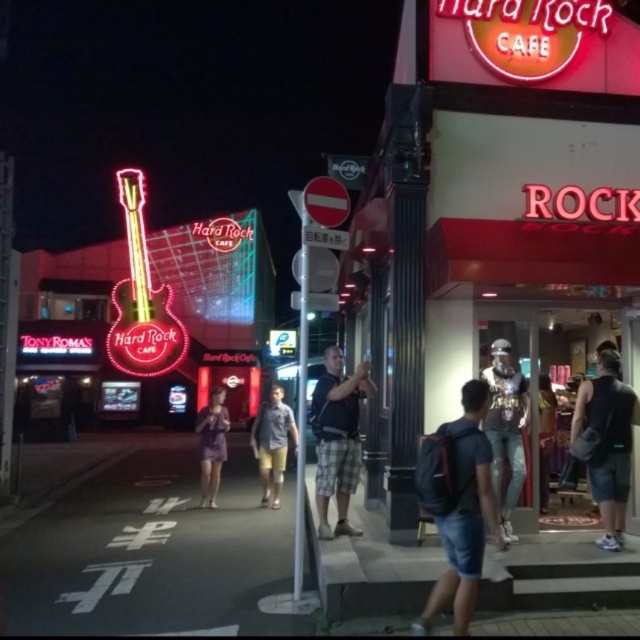
Does dark blue backpack at center appear under denim jeans at center?

Yes, dark blue backpack at center is below denim jeans at center.

Is dark blue backpack at center further to the viewer compared to denim jeans at center?

No, it is not.

The height and width of the screenshot is (640, 640). Find the location of `dark blue backpack at center`. dark blue backpack at center is located at coordinates (465, 513).

Find the location of a particular element. The width and height of the screenshot is (640, 640). dark blue backpack at center is located at coordinates (465, 513).

Find the location of a particular element. white asphalt at center is located at coordinates (152, 552).

Is white asphalt at center above dark gray plaid shorts at center?

Actually, white asphalt at center is below dark gray plaid shorts at center.

Which is behind, point (257, 508) or point (344, 445)?

Point (257, 508)

Locate an element on the screen. This screenshot has width=640, height=640. white asphalt at center is located at coordinates (152, 552).

Which is in front, point (490, 513) or point (212, 493)?

Point (490, 513) is in front.

Which is more to the left, dark blue backpack at center or purple fabric dress at center?

purple fabric dress at center

Locate an element on the screen. This screenshot has height=640, width=640. dark blue backpack at center is located at coordinates (465, 513).